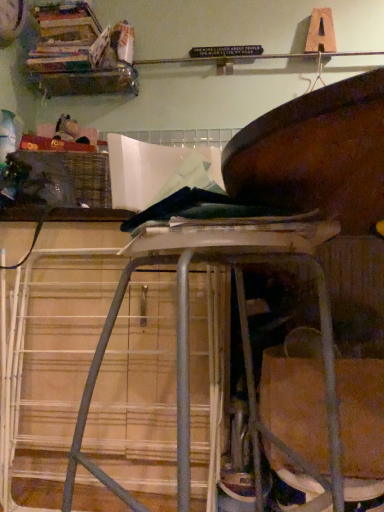
Question: Is woven plastic crate at left at the right side of wooden books at upper left?

Choices:
 (A) no
 (B) yes

Answer: (B)

Question: From a real-world perspective, is woven plastic crate at left over wooden books at upper left?

Choices:
 (A) yes
 (B) no

Answer: (B)

Question: Can you confirm if woven plastic crate at left is bigger than wooden books at upper left?

Choices:
 (A) yes
 (B) no

Answer: (A)

Question: Is the position of woven plastic crate at left more distant than that of wooden books at upper left?

Choices:
 (A) no
 (B) yes

Answer: (A)

Question: Is woven plastic crate at left far from wooden books at upper left?

Choices:
 (A) no
 (B) yes

Answer: (A)

Question: Is woven plastic crate at left closer to the viewer compared to wooden books at upper left?

Choices:
 (A) no
 (B) yes

Answer: (B)

Question: Could wooden books at upper left be considered to be inside metal stool at center?

Choices:
 (A) no
 (B) yes

Answer: (A)

Question: Are metal stool at center and wooden books at upper left making contact?

Choices:
 (A) yes
 (B) no

Answer: (B)

Question: Is metal stool at center closer to the viewer compared to wooden books at upper left?

Choices:
 (A) no
 (B) yes

Answer: (B)

Question: Is metal stool at center oriented away from wooden books at upper left?

Choices:
 (A) no
 (B) yes

Answer: (A)

Question: Considering the relative sizes of metal stool at center and wooden books at upper left in the image provided, is metal stool at center wider than wooden books at upper left?

Choices:
 (A) no
 (B) yes

Answer: (B)

Question: Is metal stool at center not close to wooden books at upper left?

Choices:
 (A) yes
 (B) no

Answer: (A)

Question: Considering the relative sizes of woven plastic crate at left and metal stool at center in the image provided, is woven plastic crate at left taller than metal stool at center?

Choices:
 (A) no
 (B) yes

Answer: (A)